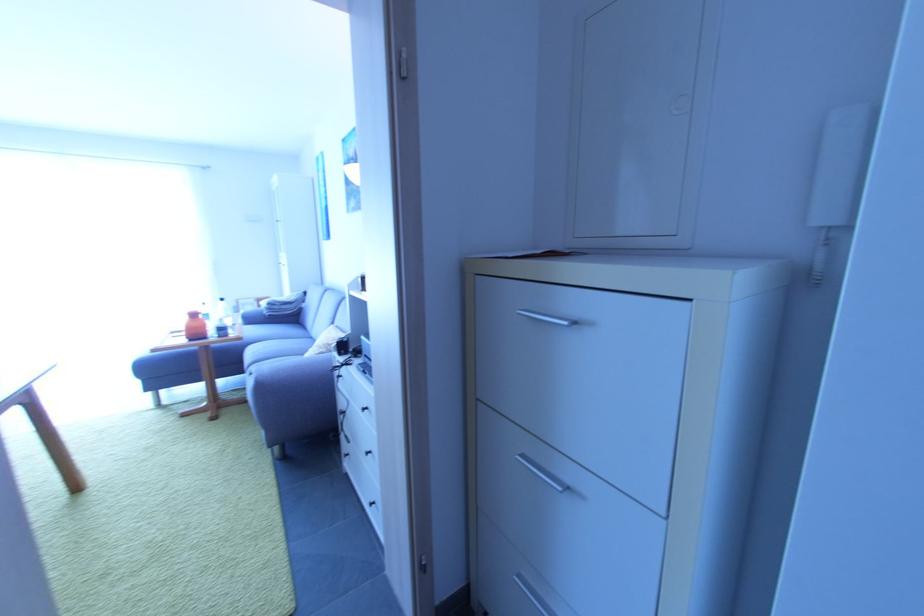
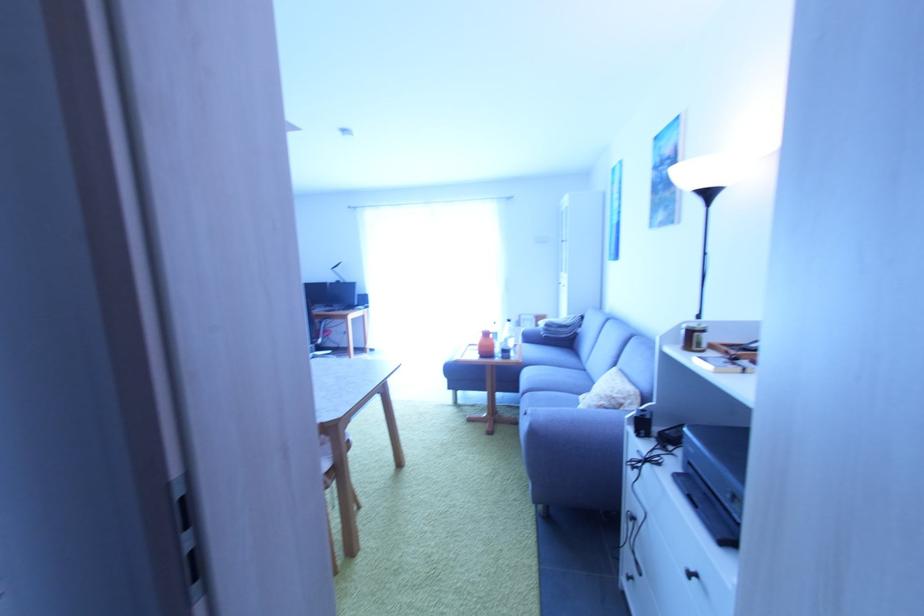
Locate, in the second image, the point that corresponds to point (199, 317) in the first image.

(492, 336)